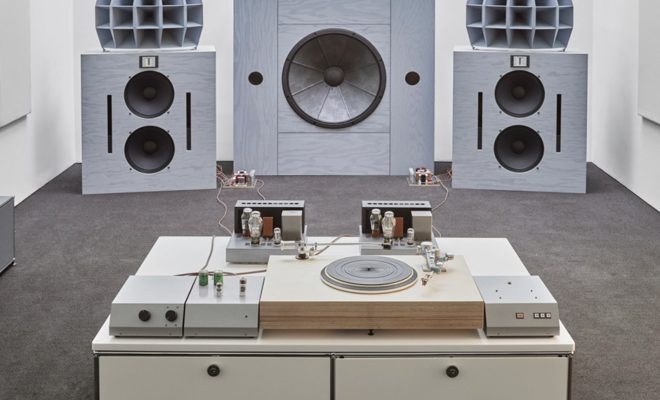
Identify the location of cable. The image size is (660, 400). (207, 256), (222, 207), (257, 190), (231, 272), (329, 247), (443, 203).